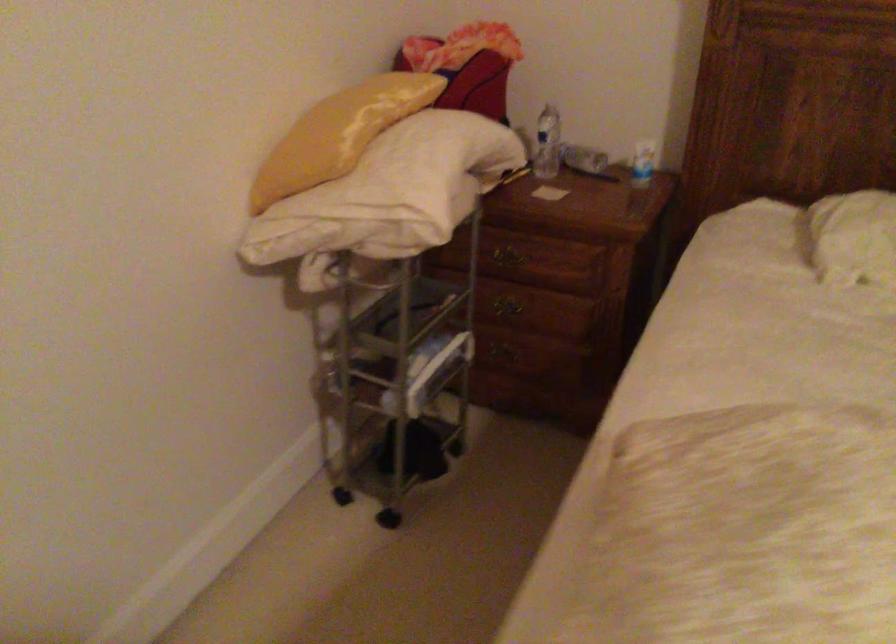
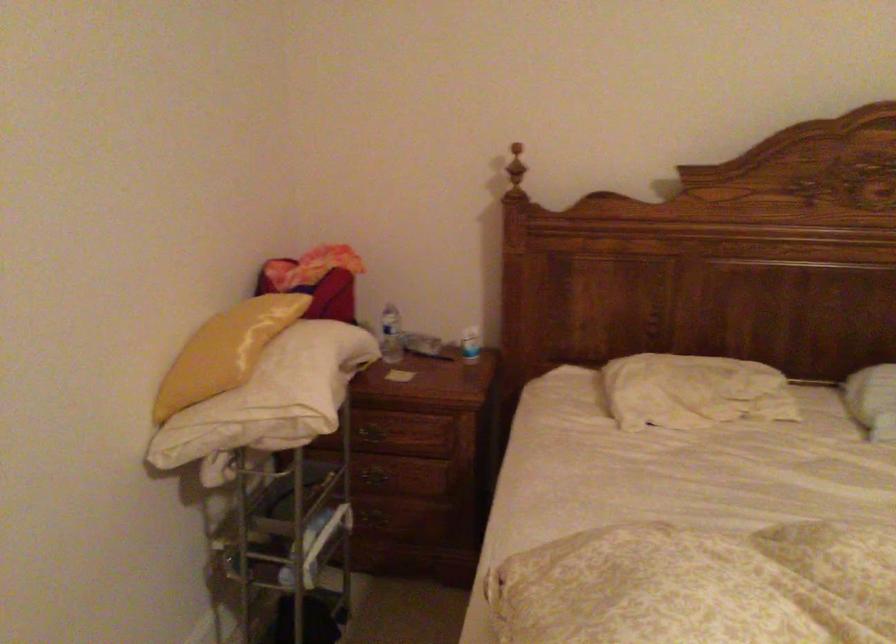
Locate, in the second image, the point that corresponds to point 395,169 in the first image.

(287, 375)